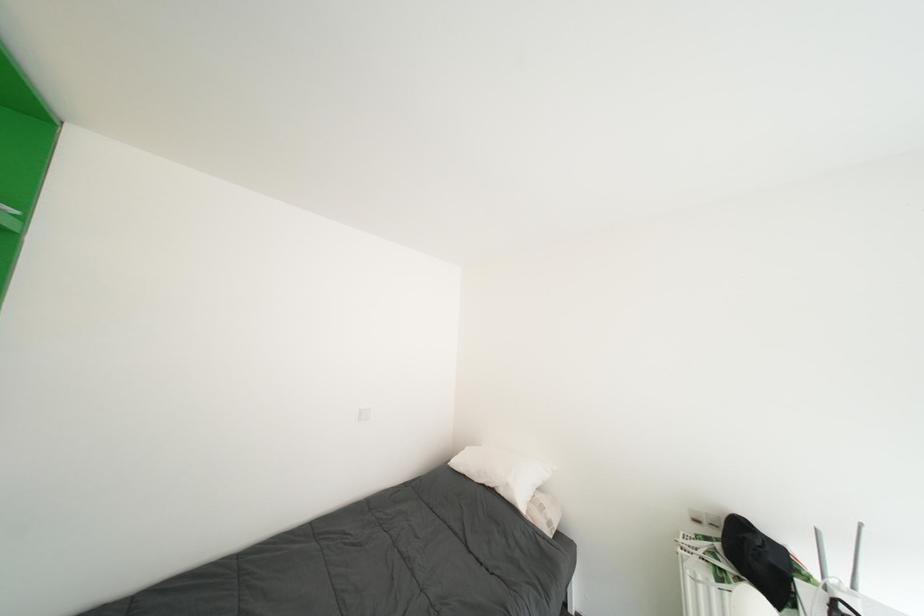
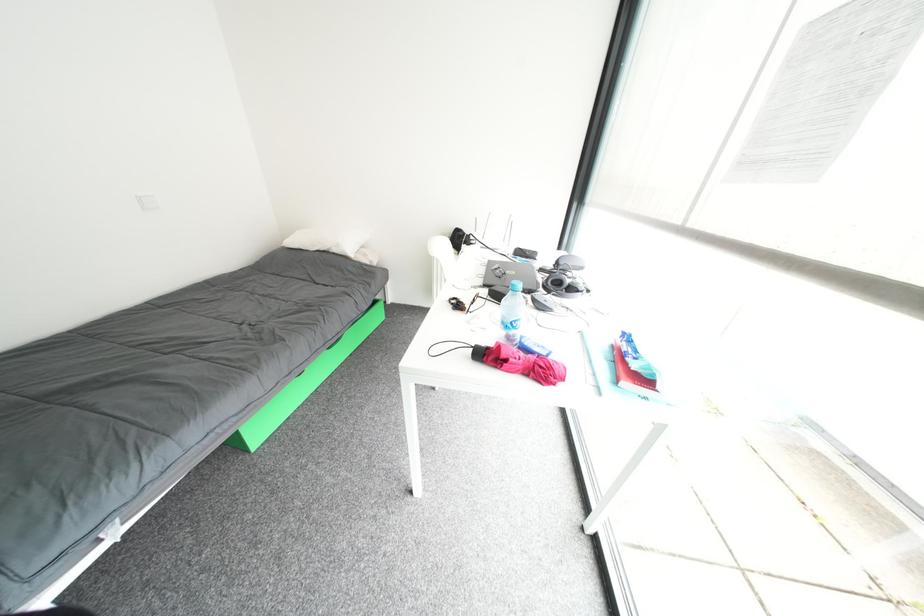
The images are taken continuously from a first-person perspective. In which direction is your viewpoint rotating?

The camera's rotation is toward right-down.